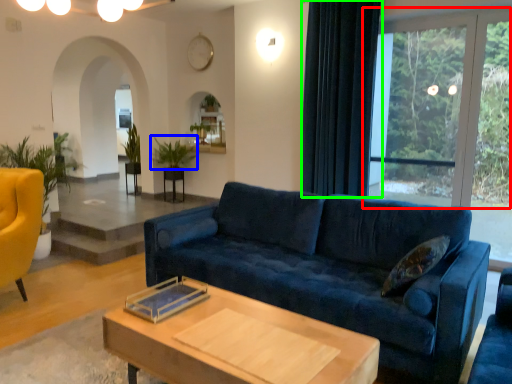
Question: Which is nearer to the window (highlighted by a red box)? plant (highlighted by a blue box) or curtain (highlighted by a green box).

Choices:
 (A) plant
 (B) curtain

Answer: (B)